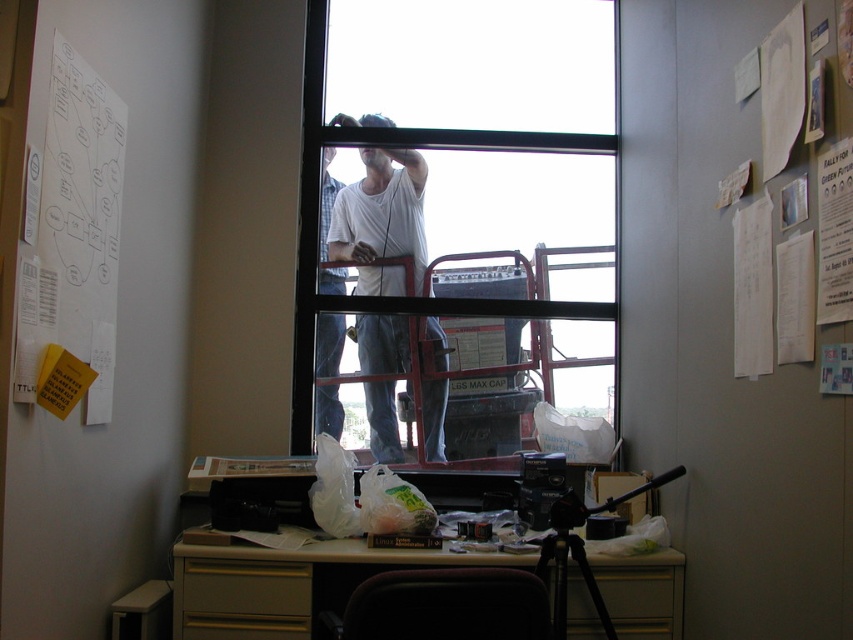
Is the position of clear glass window at center more distant than that of white matte shirt at center?

No, it is in front of white matte shirt at center.

Is clear glass window at center to the right of white matte shirt at center from the viewer's perspective?

Correct, you'll find clear glass window at center to the right of white matte shirt at center.

Where is `clear glass window at center`? The height and width of the screenshot is (640, 853). clear glass window at center is located at coordinates pos(480,157).

Is clear glass window at center taller than white plastic table at center?

Yes, clear glass window at center is taller than white plastic table at center.

Can you confirm if clear glass window at center is wider than white plastic table at center?

In fact, clear glass window at center might be narrower than white plastic table at center.

Is point (397, 164) positioned after point (611, 545)?

Yes, point (397, 164) is farther from viewer.

Locate an element on the screen. clear glass window at center is located at coordinates (480, 157).

Is white plastic table at center thinner than white cotton shirt at center?

Incorrect, white plastic table at center's width is not less than white cotton shirt at center's.

Does white plastic table at center have a larger size compared to white cotton shirt at center?

Indeed, white plastic table at center has a larger size compared to white cotton shirt at center.

This screenshot has height=640, width=853. I want to click on white plastic table at center, so click(291, 582).